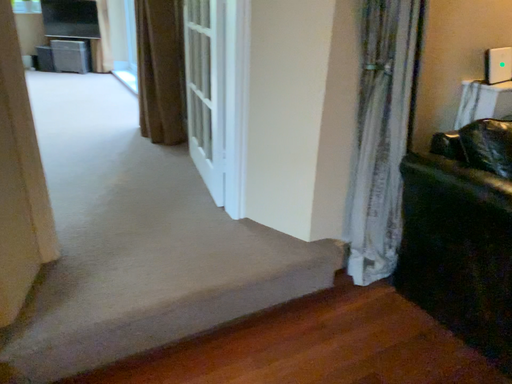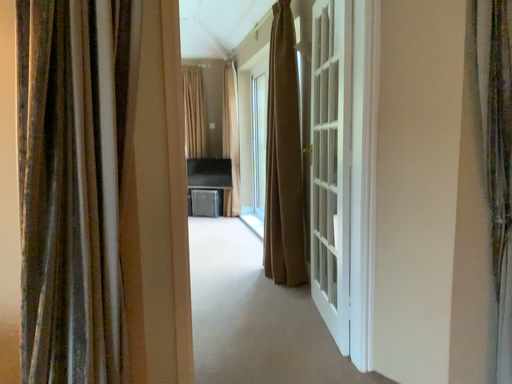
Question: Which way did the camera rotate in the video?

Choices:
 (A) rotated upward
 (B) rotated downward

Answer: (A)